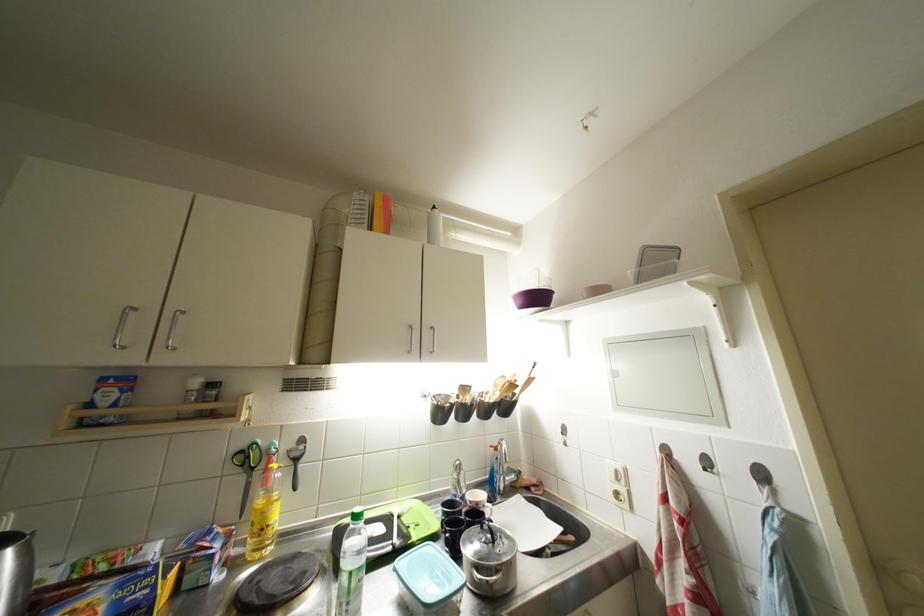
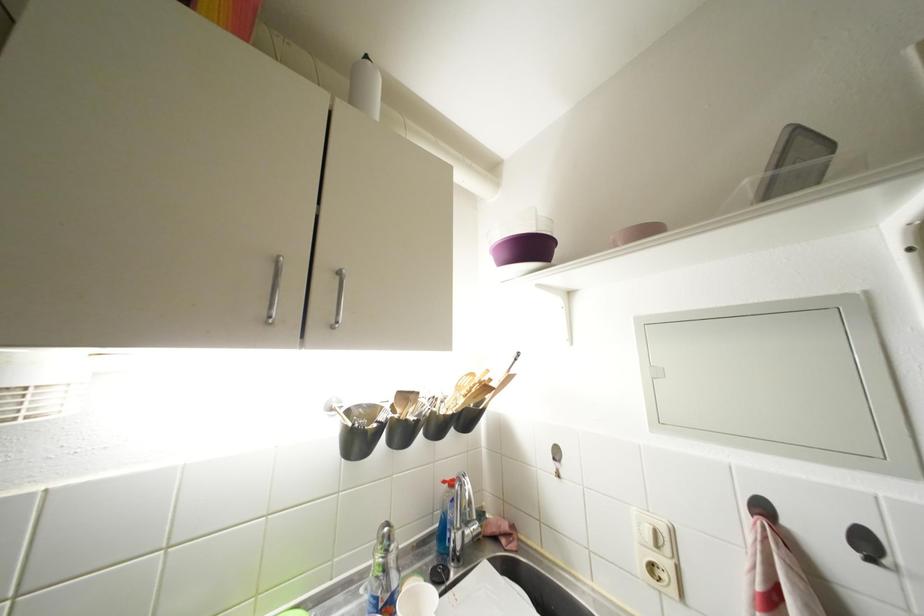
Find the pixel in the second image that matches point (712, 474) in the first image.

(877, 565)